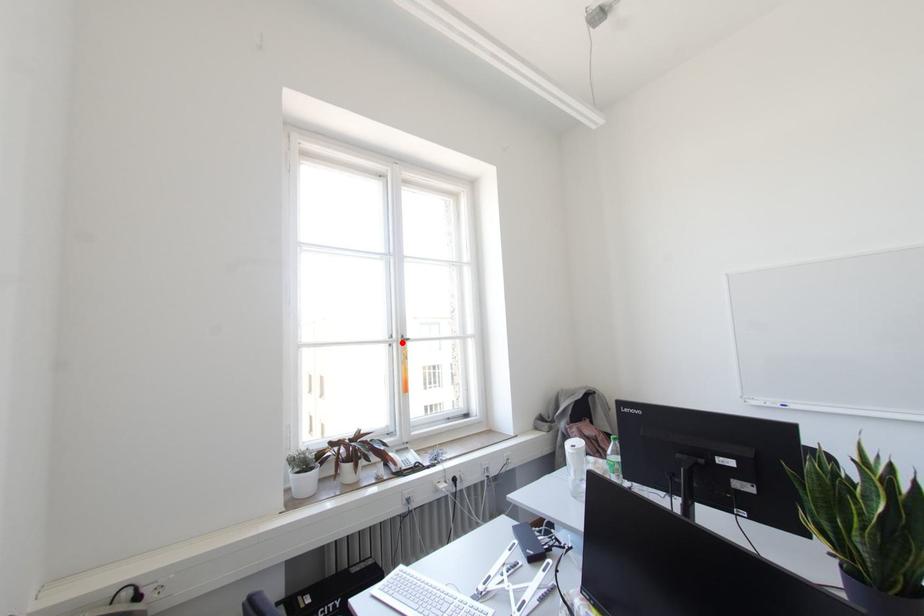
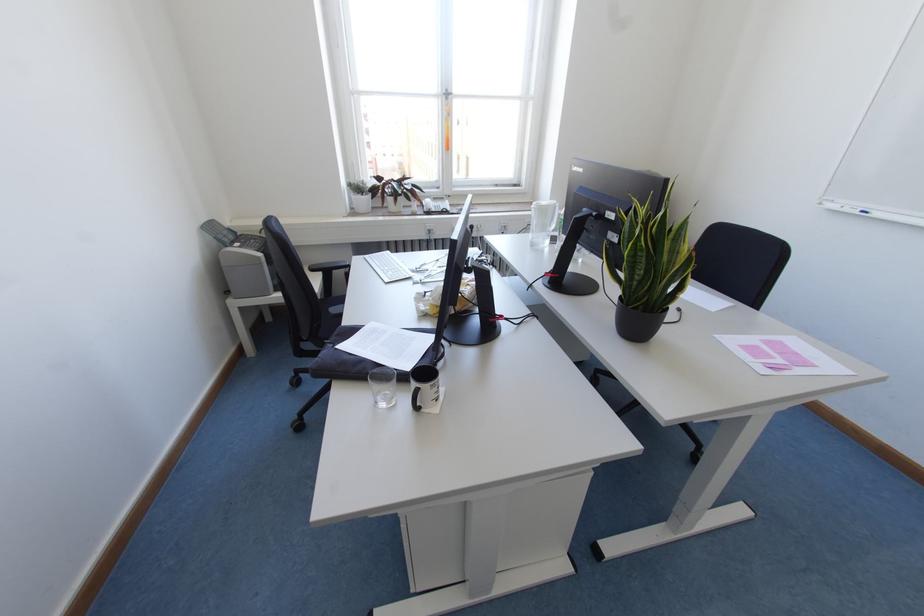
In the second image, find the point that corresponds to the highlighted location in the first image.

(446, 98)